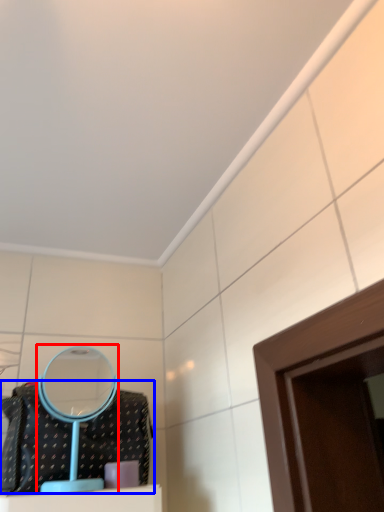
Question: Which object is closer to the camera taking this photo, mirror (highlighted by a red box) or clothing (highlighted by a blue box)?

Choices:
 (A) mirror
 (B) clothing

Answer: (B)